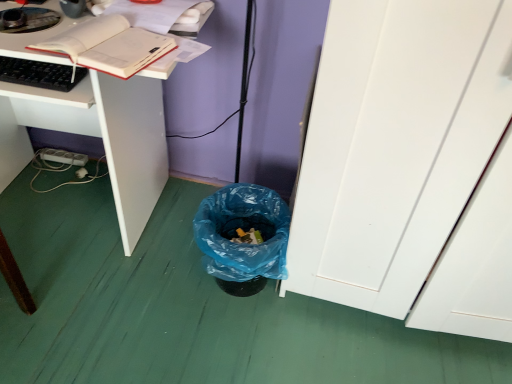
Question: Is black matte keyboard at left a part of blue plastic trash can at lower center?

Choices:
 (A) no
 (B) yes

Answer: (A)

Question: Can you confirm if blue plastic trash can at lower center is smaller than black matte keyboard at left?

Choices:
 (A) yes
 (B) no

Answer: (B)

Question: Can you confirm if blue plastic trash can at lower center is thinner than black matte keyboard at left?

Choices:
 (A) no
 (B) yes

Answer: (A)

Question: Is blue plastic trash can at lower center located outside black matte keyboard at left?

Choices:
 (A) no
 (B) yes

Answer: (B)

Question: Does blue plastic trash can at lower center appear on the left side of black matte keyboard at left?

Choices:
 (A) yes
 (B) no

Answer: (B)

Question: Is the depth of blue plastic trash can at lower center less than that of black matte keyboard at left?

Choices:
 (A) yes
 (B) no

Answer: (B)

Question: From the image's perspective, is matte white book at upper left located beneath white matte desk at lower left?

Choices:
 (A) no
 (B) yes

Answer: (A)

Question: From a real-world perspective, does matte white book at upper left stand above white matte desk at lower left?

Choices:
 (A) yes
 (B) no

Answer: (A)

Question: From the image's perspective, is matte white book at upper left located above white matte desk at lower left?

Choices:
 (A) no
 (B) yes

Answer: (B)

Question: Is matte white book at upper left positioned beyond the bounds of white matte desk at lower left?

Choices:
 (A) no
 (B) yes

Answer: (B)

Question: Does matte white book at upper left lie in front of white matte desk at lower left?

Choices:
 (A) no
 (B) yes

Answer: (B)

Question: Is matte white book at upper left turned away from white matte desk at lower left?

Choices:
 (A) yes
 (B) no

Answer: (B)

Question: Does black matte keyboard at left have a greater height compared to matte white book at upper left?

Choices:
 (A) no
 (B) yes

Answer: (A)